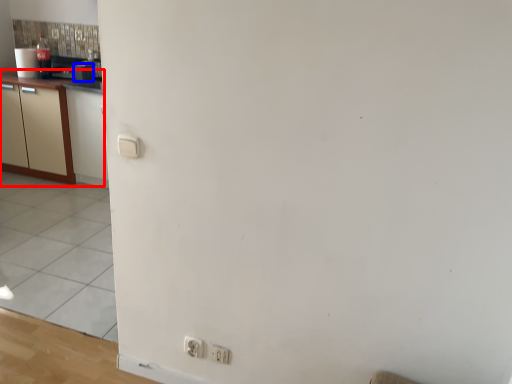
Question: Which of the following is the closest to the observer, cabinetry (highlighted by a red box) or appliance (highlighted by a blue box)?

Choices:
 (A) cabinetry
 (B) appliance

Answer: (A)